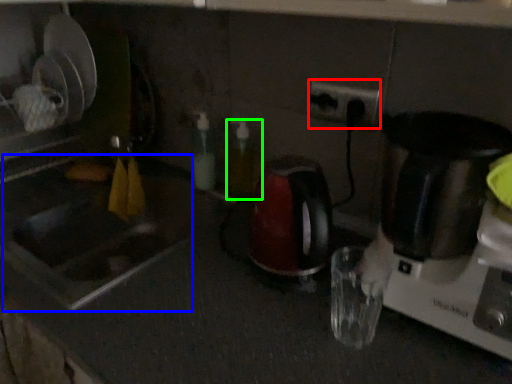
Question: Which object is positioned farthest from electric outlet (highlighted by a red box)? Select from sink (highlighted by a blue box) and bottle (highlighted by a green box).

Choices:
 (A) sink
 (B) bottle

Answer: (A)